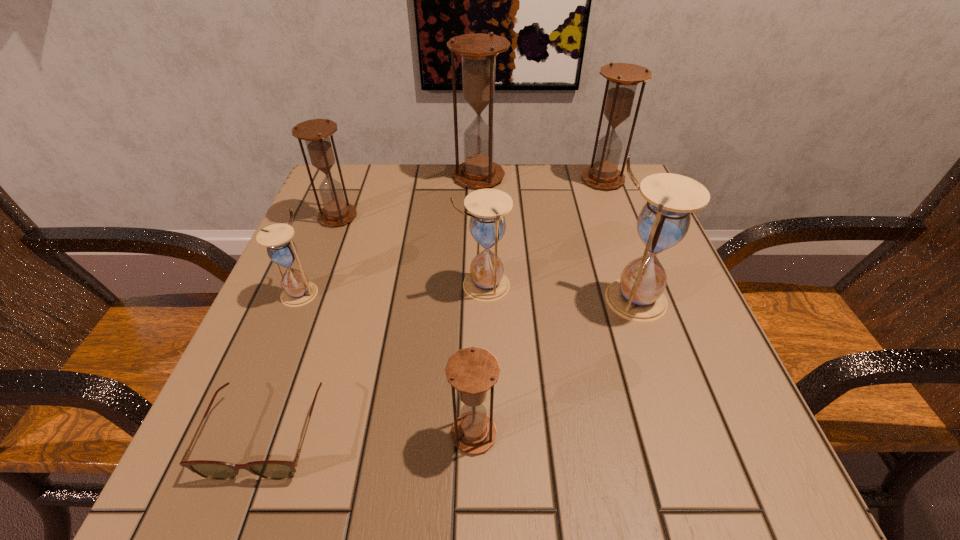
In the image, there is a desktop. Find the location of `vacant space at the near left corner`. vacant space at the near left corner is located at coordinates (276, 490).

Find the location of a particular element. vacant space at the far right corner of the desktop is located at coordinates point(606,199).

Where is `vacant area that lies between the smallest white hourglass and the nearest brown hourglass`? vacant area that lies between the smallest white hourglass and the nearest brown hourglass is located at coordinates (387, 363).

At what (x,y) coordinates should I click in order to perform the action: click on empty space between the smallest white hourglass and the second nearest brown hourglass. Please return your answer as a coordinate pair (x, y). Looking at the image, I should click on (319, 254).

At what (x,y) coordinates should I click in order to perform the action: click on vacant space that's between the smallest white hourglass and the second white hourglass from right to left. Please return your answer as a coordinate pair (x, y). This screenshot has width=960, height=540. Looking at the image, I should click on (392, 288).

Locate an element on the screen. The height and width of the screenshot is (540, 960). free space between the smallest white hourglass and the tallest object is located at coordinates (390, 234).

Where is `vacant point located between the brown spectacles and the third farthest hourglass`? The width and height of the screenshot is (960, 540). vacant point located between the brown spectacles and the third farthest hourglass is located at coordinates (302, 326).

This screenshot has height=540, width=960. In order to click on vacant area that lies between the biggest brown hourglass and the leftmost white hourglass in this screenshot , I will do `click(390, 234)`.

Identify which object is located as the second nearest to the leftmost white hourglass. Please provide its 2D coordinates. Your answer should be formatted as a tuple, i.e. [(x, y)], where the tuple contains the x and y coordinates of a point satisfying the conditions above.

[(269, 469)]

Image resolution: width=960 pixels, height=540 pixels. Find the location of `the fifth closest object to the nearest brown hourglass`. the fifth closest object to the nearest brown hourglass is located at coordinates (315, 132).